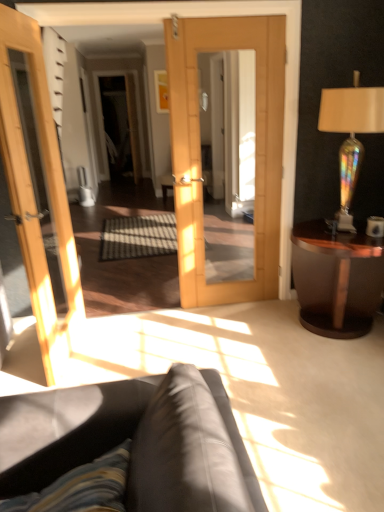
Question: From the image's perspective, relative to matte white cup at right, is leather couch at lower center above or below?

Choices:
 (A) below
 (B) above

Answer: (A)

Question: In terms of height, does leather couch at lower center look taller or shorter compared to matte white cup at right?

Choices:
 (A) tall
 (B) short

Answer: (A)

Question: Which object is positioned closest to the mahogany wood side table at right?

Choices:
 (A) matte white cup at right
 (B) iridescent glass lamp at right
 (C) leather couch at lower center

Answer: (A)

Question: Estimate the real-world distances between objects in this image. Which object is closer to the matte white cup at right?

Choices:
 (A) iridescent glass lamp at right
 (B) mahogany wood side table at right
 (C) leather couch at lower center

Answer: (B)